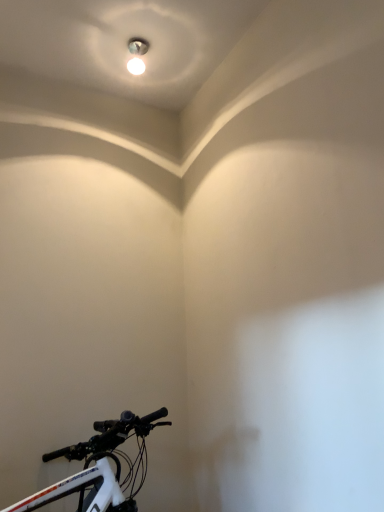
You are a GUI agent. You are given a task and a screenshot of the screen. Output one action in this format:
    pyautogui.click(x=<x>, y=<y>)
    Task: Click on the matte silver light fixture at upper center
    
    Given the screenshot: What is the action you would take?
    pyautogui.click(x=137, y=55)

Describe the element at coordinates (137, 55) in the screenshot. I see `matte silver light fixture at upper center` at that location.

Identify the location of matte silver light fixture at upper center. [137, 55].